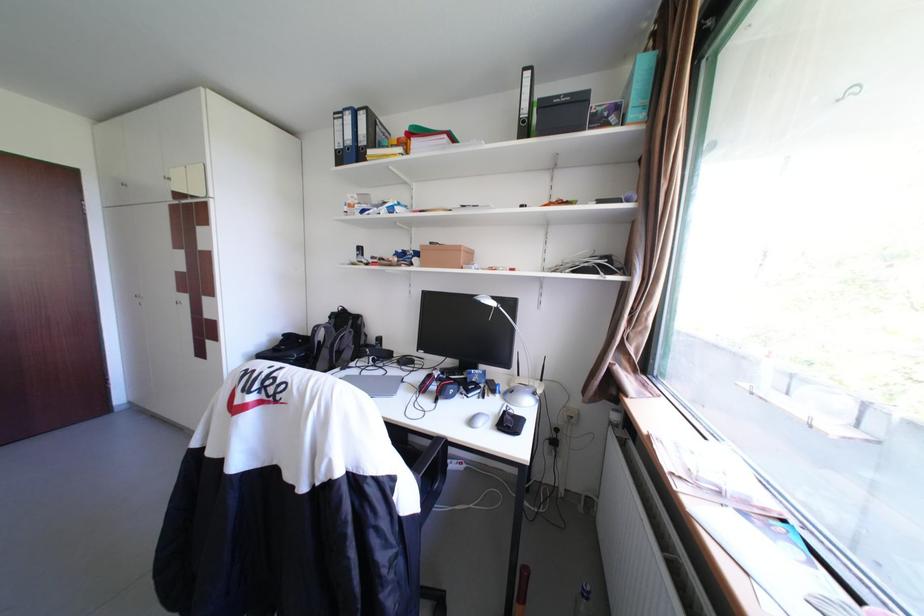
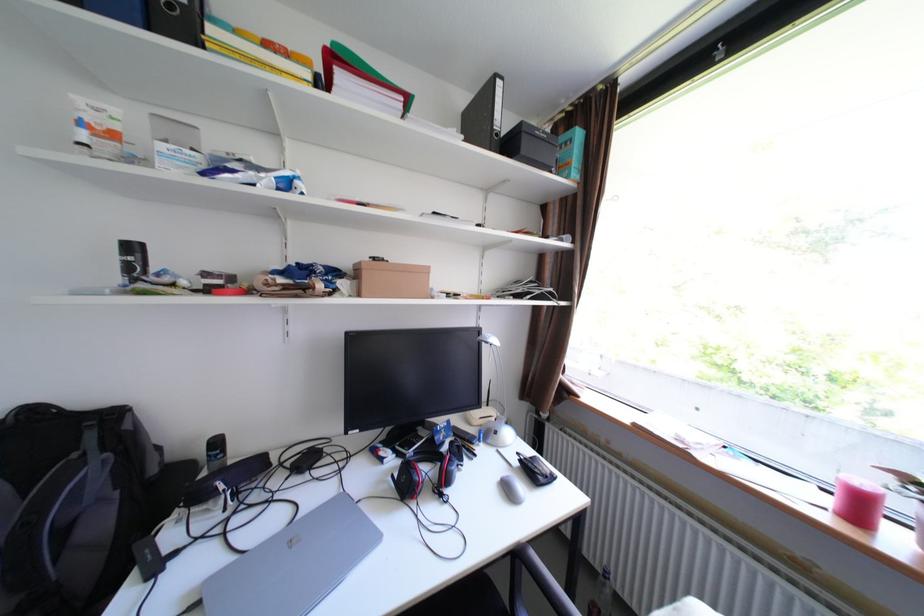
The point at (359,355) is marked in the first image. Where is the corresponding point in the second image?

(110, 524)